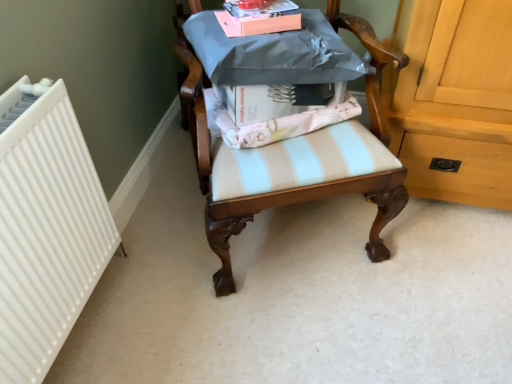
What do you see at coordinates (46, 229) in the screenshot? I see `white ribbed radiator at left` at bounding box center [46, 229].

Locate an element on the screen. white ribbed radiator at left is located at coordinates (46, 229).

Based on the photo, can you confirm if pink matte box at upper center is taller than wooden chair at center?

In fact, pink matte box at upper center may be shorter than wooden chair at center.

From the image's perspective, is pink matte box at upper center located above wooden chair at center?

Correct, pink matte box at upper center appears higher than wooden chair at center in the image.

Can you tell me how much pink matte box at upper center and wooden chair at center differ in facing direction?

4.79 degrees.

Is pink matte box at upper center with wooden chair at center?

They are not placed beside each other.

Does point (318, 186) lie in front of point (95, 193)?

No, (318, 186) is further to viewer.

Is wooden chair at center not close to white ribbed radiator at left?

No, wooden chair at center is in close proximity to white ribbed radiator at left.

Is wooden chair at center behind white ribbed radiator at left?

No, it is in front of white ribbed radiator at left.

This screenshot has width=512, height=384. I want to click on radiator on the left side of wooden chair at center, so click(x=46, y=229).

Is pink matte box at upper center facing away from white ribbed radiator at left?

No, pink matte box at upper center's orientation is not away from white ribbed radiator at left.

Can you see pink matte box at upper center touching white ribbed radiator at left?

No, pink matte box at upper center is not in contact with white ribbed radiator at left.

Can white ribbed radiator at left be found inside pink matte box at upper center?

No, white ribbed radiator at left is located outside of pink matte box at upper center.

Is pink matte box at upper center closer to camera compared to white ribbed radiator at left?

Yes, pink matte box at upper center is closer to the viewer.

Which object is closer to the camera, white ribbed radiator at left or wooden chair at center?

wooden chair at center is in front.

Is white ribbed radiator at left inside the boundaries of wooden chair at center, or outside?

white ribbed radiator at left is not inside wooden chair at center, it's outside.

From a real-world perspective, does white ribbed radiator at left stand above wooden chair at center?

No.

From the image's perspective, is white ribbed radiator at left on top of wooden chair at center?

Incorrect, from the image's perspective, white ribbed radiator at left is lower than wooden chair at center.

Which of these two, white ribbed radiator at left or pink matte box at upper center, stands shorter?

Standing shorter between the two is pink matte box at upper center.

Is white ribbed radiator at left to the left of pink matte box at upper center from the viewer's perspective?

Yes.

Are white ribbed radiator at left and pink matte box at upper center making contact?

No, white ribbed radiator at left is not with pink matte box at upper center.

From the image's perspective, is white ribbed radiator at left located above or below pink matte box at upper center?

white ribbed radiator at left is situated lower than pink matte box at upper center in the image.

In the scene shown: Does wooden chair at center have a greater height compared to pink matte box at upper center?

Yes.

Considering the relative sizes of wooden chair at center and pink matte box at upper center in the image provided, is wooden chair at center thinner than pink matte box at upper center?

In fact, wooden chair at center might be wider than pink matte box at upper center.

From the image's perspective, is wooden chair at center over pink matte box at upper center?

No, from the image's perspective, wooden chair at center is not over pink matte box at upper center.

How different are the orientations of wooden chair at center and pink matte box at upper center in degrees?

4.79 degrees.

You are a GUI agent. You are given a task and a screenshot of the screen. Output one action in this format:
    pyautogui.click(x=<x>, y=<y>)
    Task: Click on the chair that is in front of the pink matte box at upper center
    
    Given the screenshot: What is the action you would take?
    pyautogui.click(x=276, y=190)

At what (x,y) coordinates should I click in order to perform the action: click on radiator on the left of the wooden chair at center. Please return your answer as a coordinate pair (x, y). The height and width of the screenshot is (384, 512). Looking at the image, I should click on (46, 229).

Based on their spatial positions, is white ribbed radiator at left or wooden chair at center further from pink matte box at upper center?

Among the two, white ribbed radiator at left is located further to pink matte box at upper center.

Estimate the real-world distances between objects in this image. Which object is closer to wooden chair at center, pink matte box at upper center or white ribbed radiator at left?

pink matte box at upper center.

When comparing their distances from white ribbed radiator at left, does wooden chair at center or pink matte box at upper center seem further?

pink matte box at upper center.

Considering their positions, is pink matte box at upper center positioned closer to white ribbed radiator at left than wooden chair at center?

Among the two, wooden chair at center is located nearer to white ribbed radiator at left.

From the image, which object appears to be nearer to wooden chair at center, white ribbed radiator at left or pink matte box at upper center?

pink matte box at upper center is closer to wooden chair at center.

Looking at the image, which one is located closer to pink matte box at upper center, wooden chair at center or white ribbed radiator at left?

wooden chair at center.

Image resolution: width=512 pixels, height=384 pixels. I want to click on book situated between white ribbed radiator at left and wooden chair at center from left to right, so click(x=259, y=19).